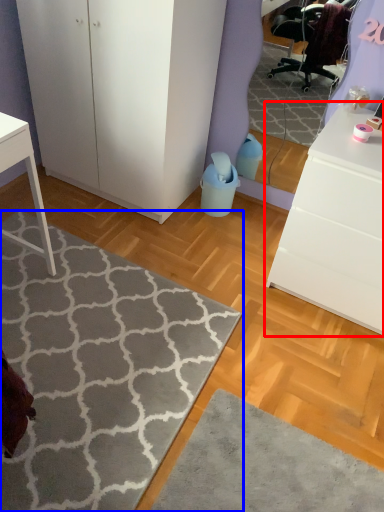
Question: Which of the following is the closest to the observer, chest of drawers (highlighted by a red box) or doormat (highlighted by a blue box)?

Choices:
 (A) chest of drawers
 (B) doormat

Answer: (B)